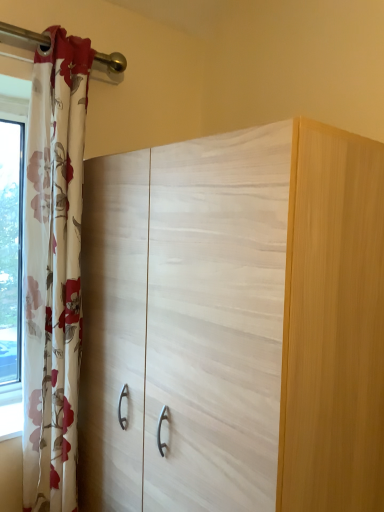
Question: From the image's perspective, would you say floral sheer curtain at left is positioned over white wood cupboard at center?

Choices:
 (A) no
 (B) yes

Answer: (B)

Question: Is floral sheer curtain at left shorter than white wood cupboard at center?

Choices:
 (A) yes
 (B) no

Answer: (B)

Question: Is floral sheer curtain at left positioned before white wood cupboard at center?

Choices:
 (A) yes
 (B) no

Answer: (B)

Question: Is floral sheer curtain at left oriented away from white wood cupboard at center?

Choices:
 (A) yes
 (B) no

Answer: (B)

Question: From a real-world perspective, is floral sheer curtain at left on top of white wood cupboard at center?

Choices:
 (A) no
 (B) yes

Answer: (B)

Question: Is the surface of floral sheer curtain at left in direct contact with white wood cupboard at center?

Choices:
 (A) no
 (B) yes

Answer: (A)

Question: From a real-world perspective, is white wood cupboard at center beneath floral sheer curtain at left?

Choices:
 (A) no
 (B) yes

Answer: (B)

Question: Is white wood cupboard at center smaller than floral sheer curtain at left?

Choices:
 (A) yes
 (B) no

Answer: (B)

Question: Is white wood cupboard at center positioned with its back to floral sheer curtain at left?

Choices:
 (A) yes
 (B) no

Answer: (B)

Question: Can you confirm if white wood cupboard at center is taller than floral sheer curtain at left?

Choices:
 (A) yes
 (B) no

Answer: (B)

Question: Is white wood cupboard at center to the left of floral sheer curtain at left from the viewer's perspective?

Choices:
 (A) no
 (B) yes

Answer: (A)

Question: Is white wood cupboard at center not close to floral sheer curtain at left?

Choices:
 (A) yes
 (B) no

Answer: (B)

Question: Is white wood cupboard at center bigger or smaller than floral sheer curtain at left?

Choices:
 (A) big
 (B) small

Answer: (A)